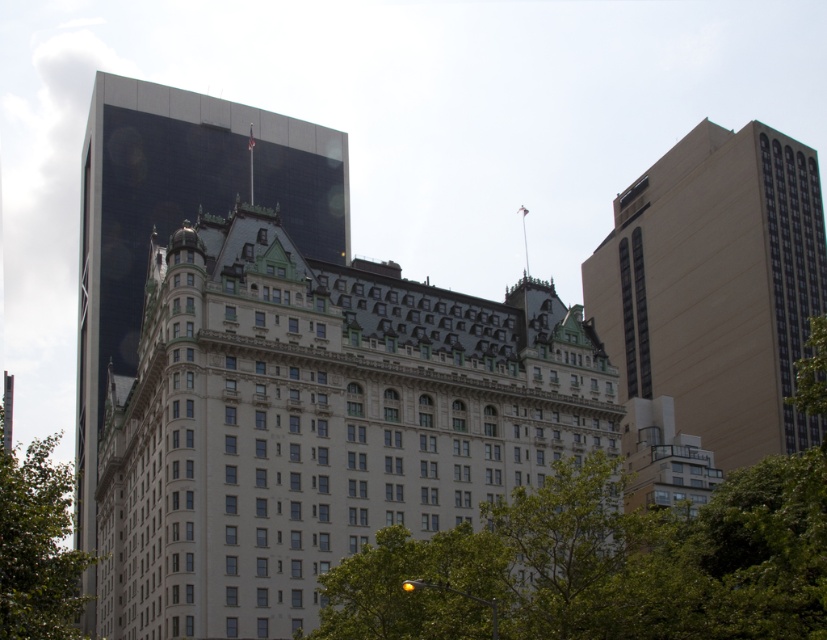
Question: Which is nearer to the green leafy tree at center?

Choices:
 (A) white stone building at center
 (B) beige concrete building at right

Answer: (A)

Question: From the image, what is the correct spatial relationship of white stone building at center in relation to green leafy tree at lower left?

Choices:
 (A) left
 (B) right

Answer: (B)

Question: Is white stone building at center positioned in front of beige concrete building at right?

Choices:
 (A) yes
 (B) no

Answer: (A)

Question: Estimate the real-world distances between objects in this image. Which object is farther from the glassy reflective tower at upper left?

Choices:
 (A) beige concrete building at right
 (B) green leafy tree at lower left
 (C) white stone building at center

Answer: (A)

Question: Is green leafy tree at center closer to the viewer compared to beige concrete building at right?

Choices:
 (A) yes
 (B) no

Answer: (A)

Question: Which of these objects is positioned farthest from the beige concrete building at right?

Choices:
 (A) green leafy tree at center
 (B) white stone building at center
 (C) green leafy tree at lower left

Answer: (C)